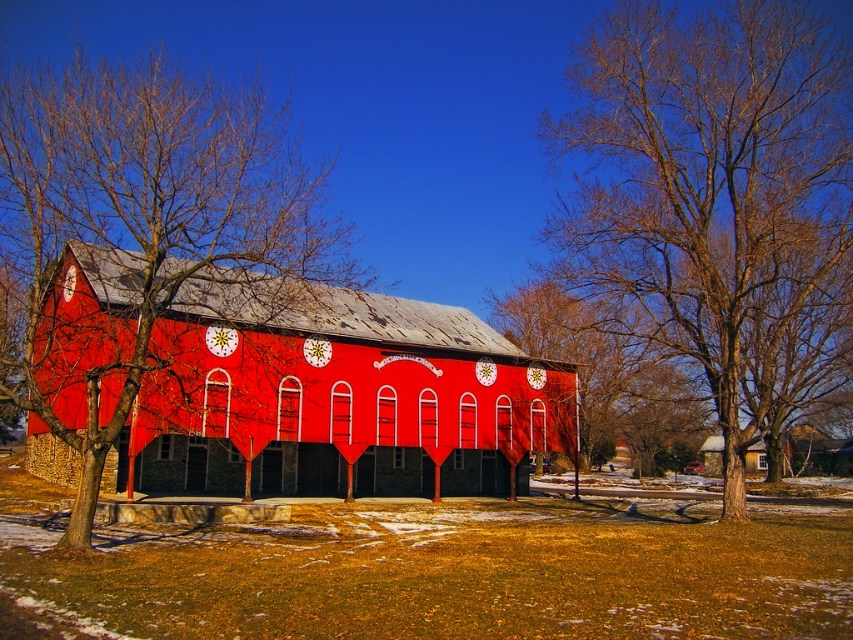
You are standing in the foreground of the image and want to determine which object is taller between the bare branches at center and the smooth wooden house at lower right. Based on the scene, which one is taller?

The bare branches at center is taller than the smooth wooden house at lower right.

You are standing in the foreground of the scene and want to reach the smooth wooden house at lower right. Are the bare branches at center blocking your path?

The smooth wooden house at lower right is behind the bare branches at center, so the bare branches at center are blocking your path to the smooth wooden house at lower right.